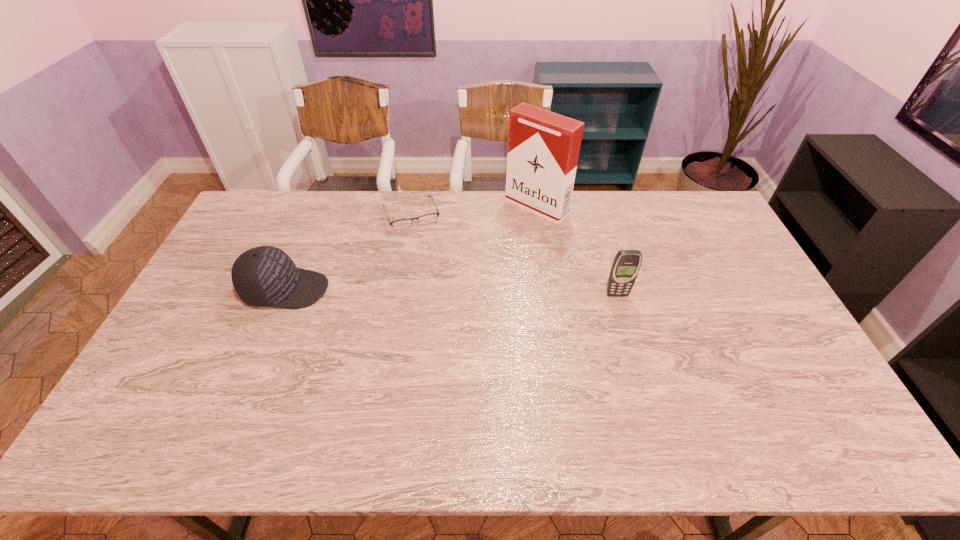
Where is `vacant area at the near edge`? vacant area at the near edge is located at coordinates (405, 381).

You are a GUI agent. You are given a task and a screenshot of the screen. Output one action in this format:
    pyautogui.click(x=<x>, y=<y>)
    Task: Click on the free space at the left edge of the desktop
    The width and height of the screenshot is (960, 540).
    Given the screenshot: What is the action you would take?
    pyautogui.click(x=235, y=252)

Locate an element on the screen. The width and height of the screenshot is (960, 540). free region at the far left corner is located at coordinates (264, 203).

Identify the location of free spot between the tallest object and the third tallest object. (411, 248).

Image resolution: width=960 pixels, height=540 pixels. What are the coordinates of `free space between the cigarette_case and the baseball cap` in the screenshot? It's located at (411, 248).

Where is `free point between the leftmost object and the cellular telephone`? free point between the leftmost object and the cellular telephone is located at coordinates (451, 292).

This screenshot has width=960, height=540. Identify the location of blank region between the baseball cap and the shortest object. (348, 252).

Where is `vacant area that lies between the third object from right to left and the rightmost object`? The image size is (960, 540). vacant area that lies between the third object from right to left and the rightmost object is located at coordinates (514, 254).

Locate an element on the screen. Image resolution: width=960 pixels, height=540 pixels. free space between the third object from left to right and the baseball cap is located at coordinates (411, 248).

Image resolution: width=960 pixels, height=540 pixels. Find the location of `free point between the third tallest object and the second object from right to left`. free point between the third tallest object and the second object from right to left is located at coordinates (x=411, y=248).